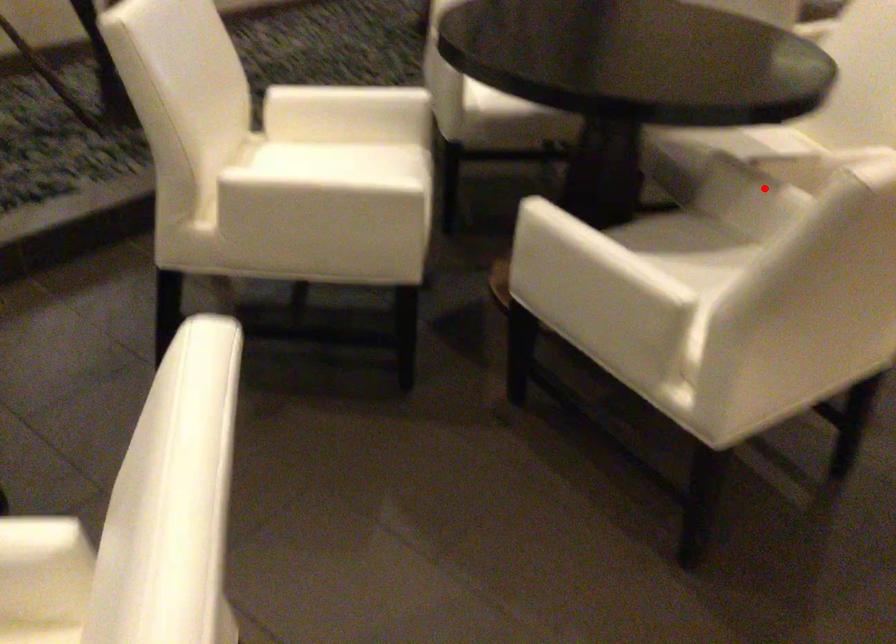
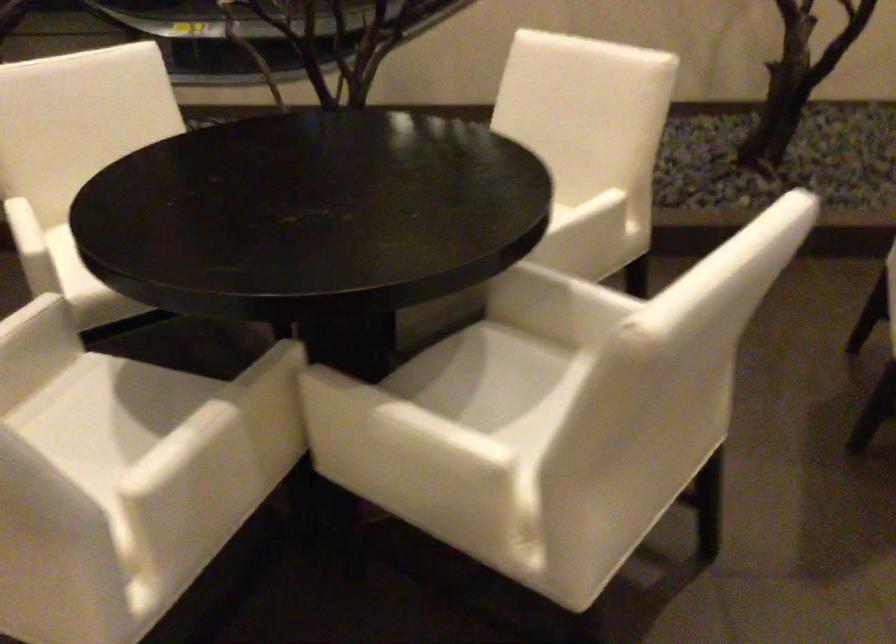
Find the pixel in the second image that matches the highlighted location in the first image.

(271, 408)